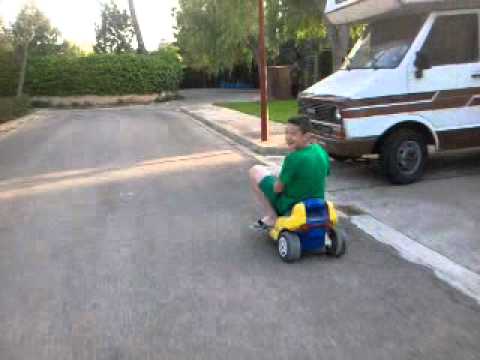
Where is `gray windows`? This screenshot has height=360, width=480. gray windows is located at coordinates (377, 52), (448, 38).